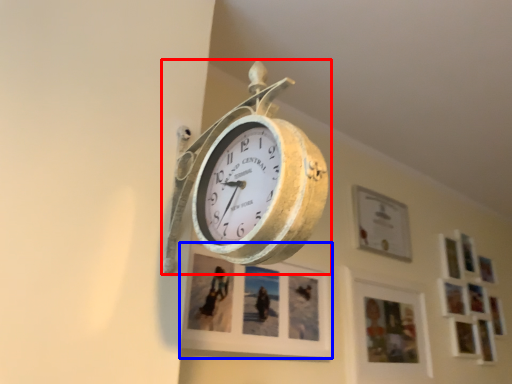
Question: Which of the following is the closest to the observer, wall clock (highlighted by a red box) or picture frame (highlighted by a blue box)?

Choices:
 (A) wall clock
 (B) picture frame

Answer: (A)